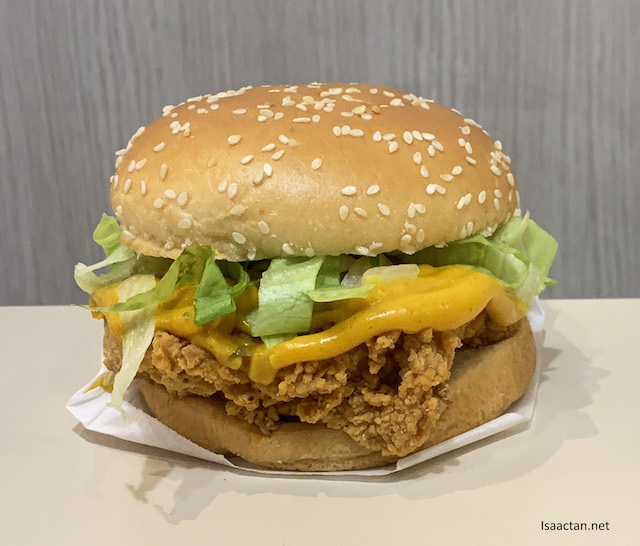
Image resolution: width=640 pixels, height=546 pixels. Find the location of `wall`. wall is located at coordinates (35, 111).